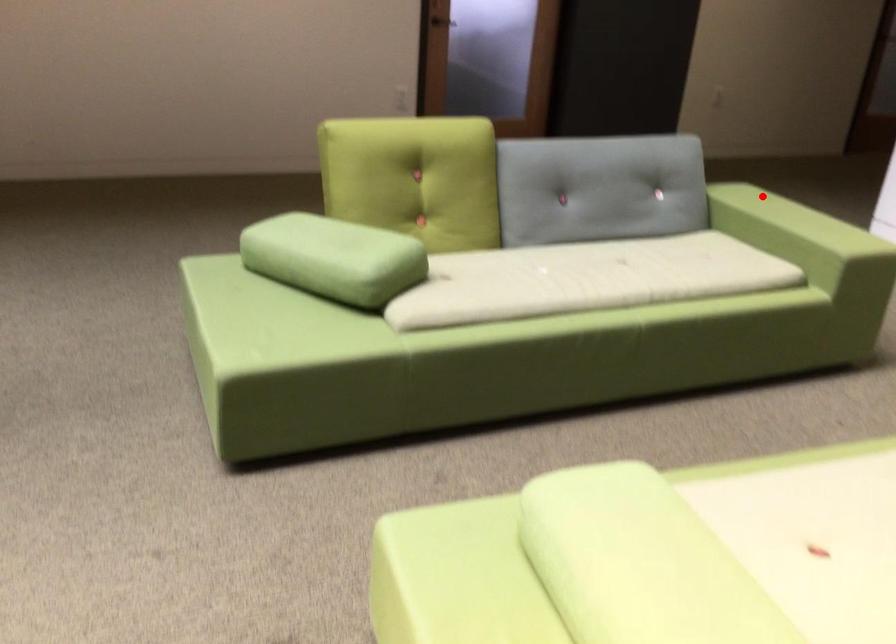
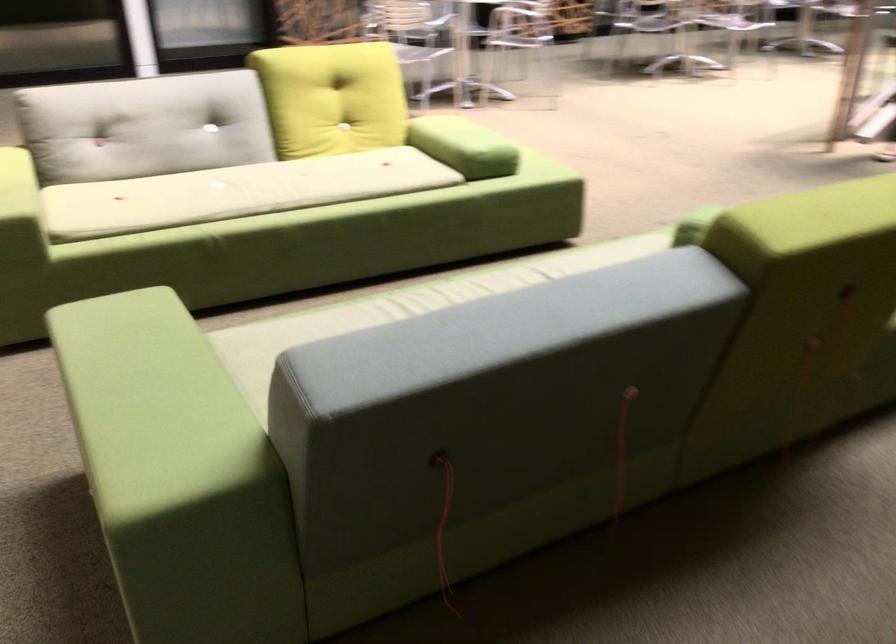
In the second image, find the point that corresponds to the highlighted location in the first image.

(151, 404)